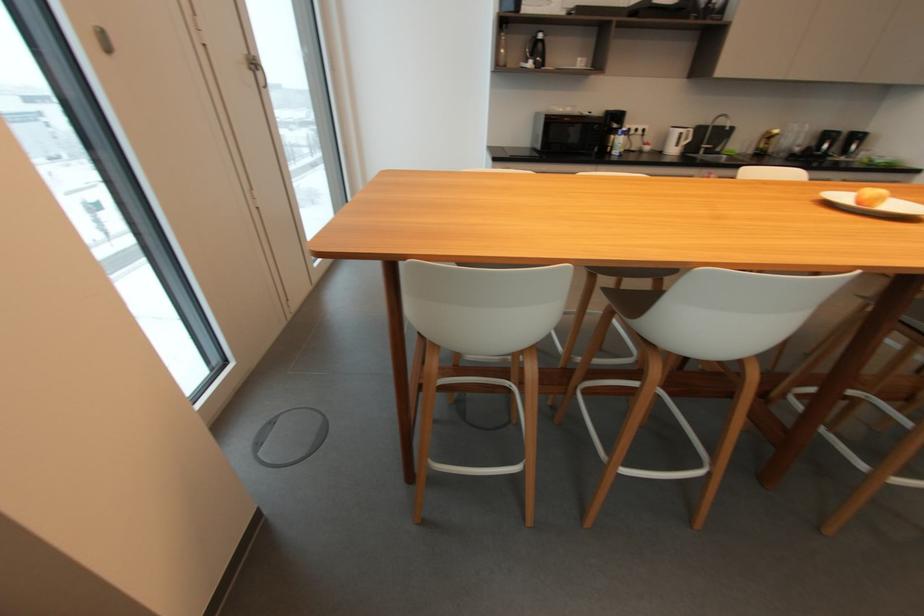
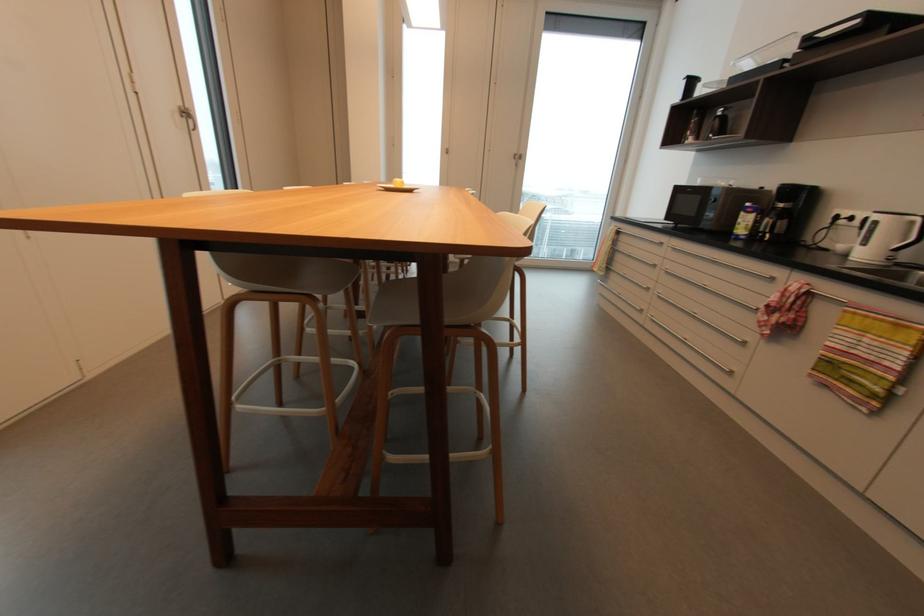
Where in the second image is the point corresponding to the point at 691,132 from the first image?

(916, 223)